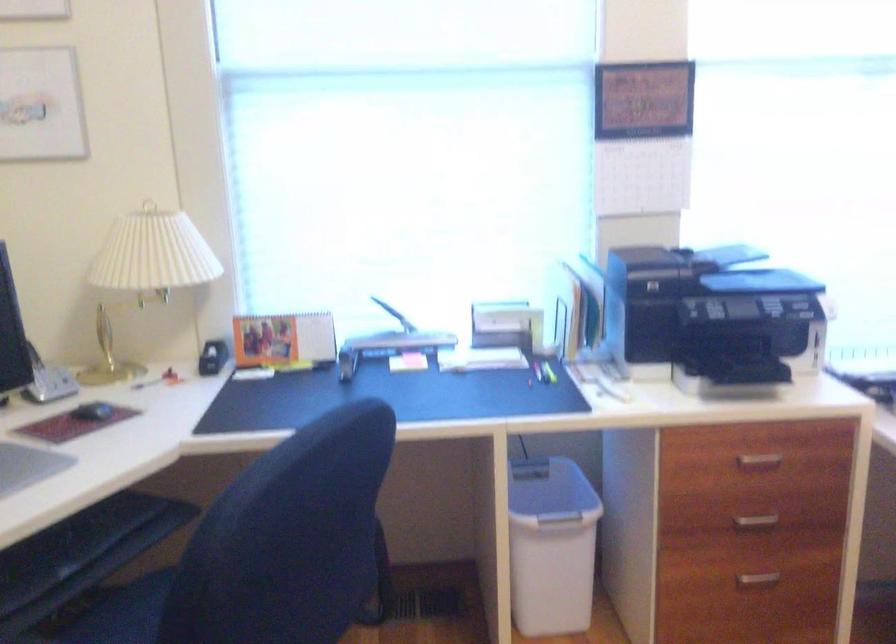
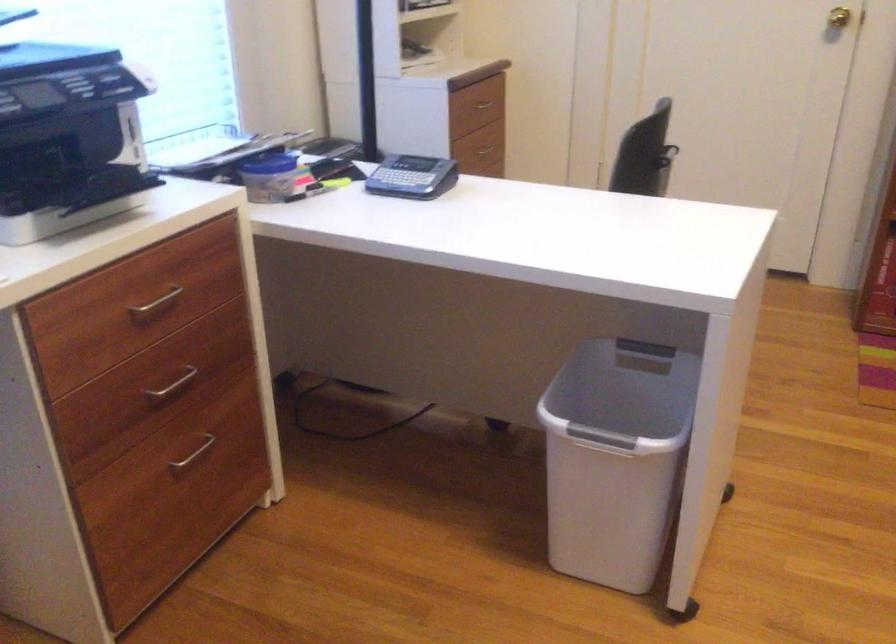
Where in the second image is the point corresponding to the point at 757,458 from the first image?

(156, 303)